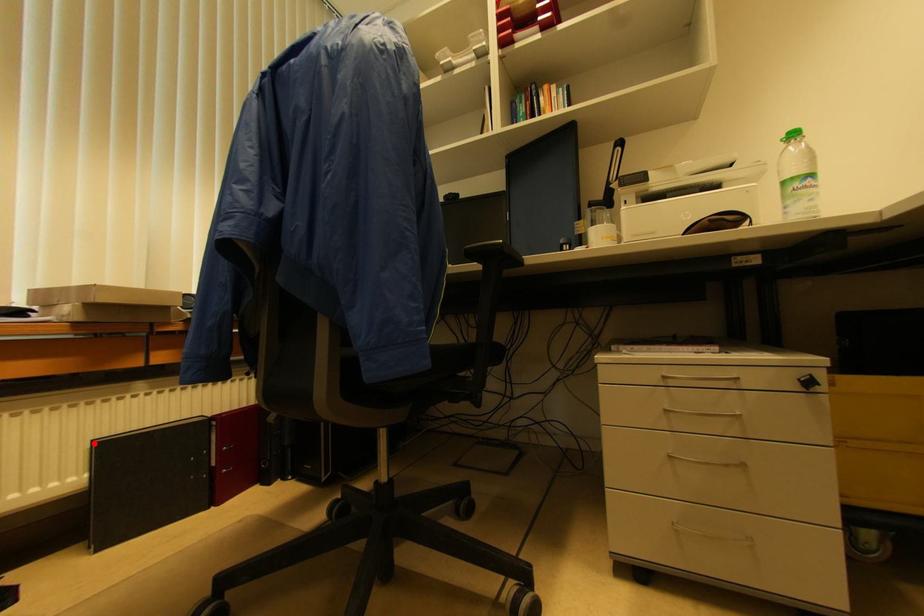
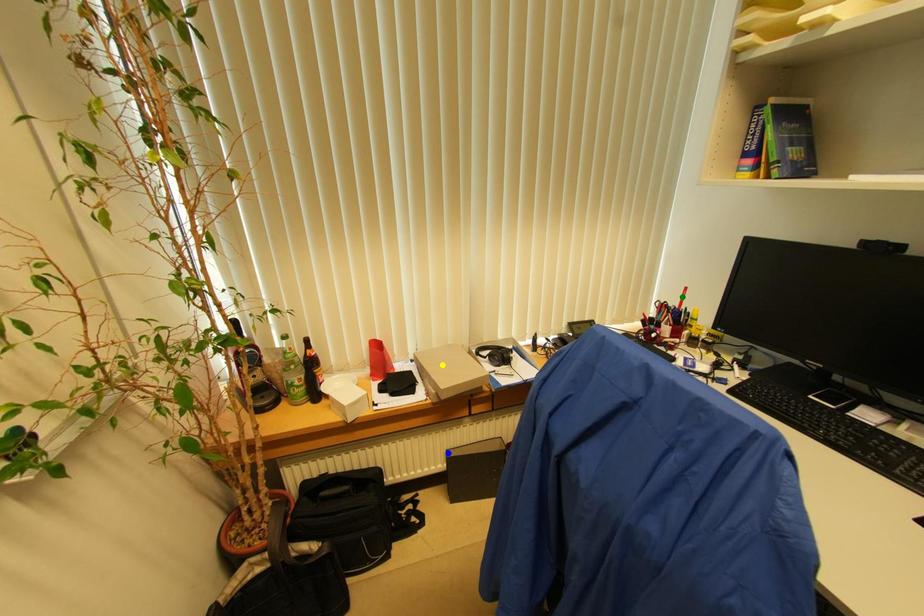
Question: I am providing you with two images of the same scene from different viewpoints. A red point is marked on the first image. You are given multiple points on the second image. Which point in image 2 is actually the same real-world point as the red point in image 1?

Choices:
 (A) blue point
 (B) green point
 (C) yellow point

Answer: (A)